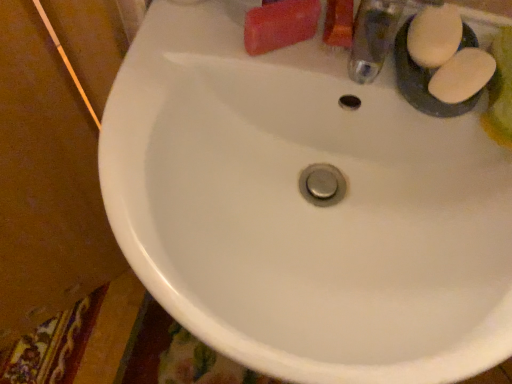
Question: Is white matte soap at upper right, which appears as the 2th soap when viewed from the right, in front of or behind white matte soap at upper right, which appears as the third soap when viewed from the left, in the image?

Choices:
 (A) behind
 (B) front

Answer: (A)

Question: In the image, is white matte soap at upper right, which is the 2th soap in left-to-right order, on the left side or the right side of white matte soap at upper right, which appears as the third soap when viewed from the left?

Choices:
 (A) left
 (B) right

Answer: (A)

Question: Which is farther from the white matte soap at upper right, which appears as the third soap when viewed from the left?

Choices:
 (A) white matte soap at upper right, which is the 2th soap in left-to-right order
 (B) matte pink bar of soap at upper right, placed as the third soap when sorted from right to left

Answer: (B)

Question: Estimate the real-world distances between objects in this image. Which object is closer to the white matte soap at upper right, which is the 2th soap in left-to-right order?

Choices:
 (A) white matte soap at upper right, which is counted as the first soap, starting from the right
 (B) matte pink bar of soap at upper right, placed as the third soap when sorted from right to left

Answer: (A)